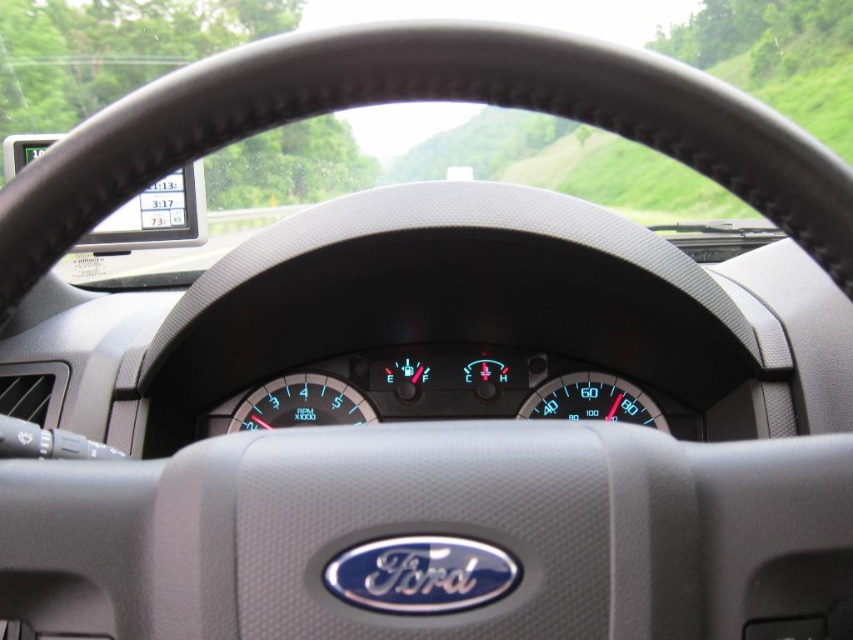
Looking at this image, how much distance is there between transparent glass windshield at upper center and blue glossy speedometer at center?

transparent glass windshield at upper center is 33.61 inches away from blue glossy speedometer at center.

Does transparent glass windshield at upper center appear on the right side of blue glossy speedometer at center?

Incorrect, transparent glass windshield at upper center is not on the right side of blue glossy speedometer at center.

Does point (242, 81) come farther from viewer compared to point (618, 417)?

No, (242, 81) is in front of (618, 417).

Where is `transparent glass windshield at upper center`? The image size is (853, 640). transparent glass windshield at upper center is located at coordinates (755, 180).

Does blue digital display at center have a lesser width compared to blue glossy speedometer at center?

In fact, blue digital display at center might be wider than blue glossy speedometer at center.

I want to click on blue digital display at center, so click(300, 403).

Is transparent glass windshield at upper center closer to the viewer compared to blue digital display at center?

Yes, it is.

Between point (480, 90) and point (276, 422), which one is positioned behind?

Point (276, 422)

Is point (756, 188) positioned behind point (318, 388)?

That is False.

Locate an element on the screen. Image resolution: width=853 pixels, height=640 pixels. transparent glass windshield at upper center is located at coordinates (755, 180).